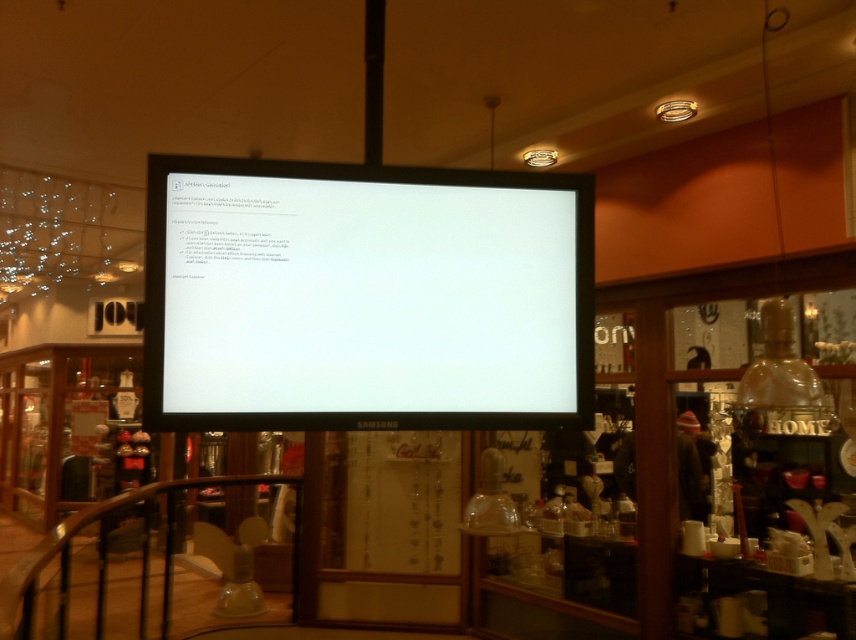
Who is more distant from viewer, (435, 246) or (102, 588)?

The point (102, 588) is more distant.

Is point (513, 209) in front of point (182, 484)?

Yes, point (513, 209) is in front of point (182, 484).

The width and height of the screenshot is (856, 640). What are the coordinates of `white glossy monitor at center` in the screenshot? It's located at (366, 296).